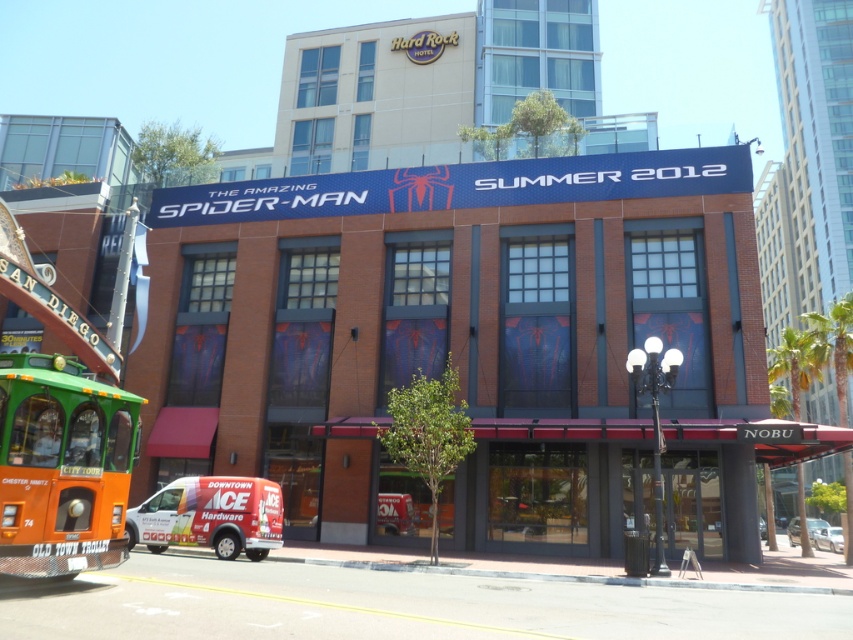
Locate an element on the screen. The width and height of the screenshot is (853, 640). orange matte trolley at lower left is located at coordinates (62, 467).

Which of these two, orange matte trolley at lower left or white vinyl van at lower left, stands taller?

With more height is orange matte trolley at lower left.

Is point (49, 404) closer to camera compared to point (131, 544)?

Yes.

The image size is (853, 640). Identify the location of orange matte trolley at lower left. (62, 467).